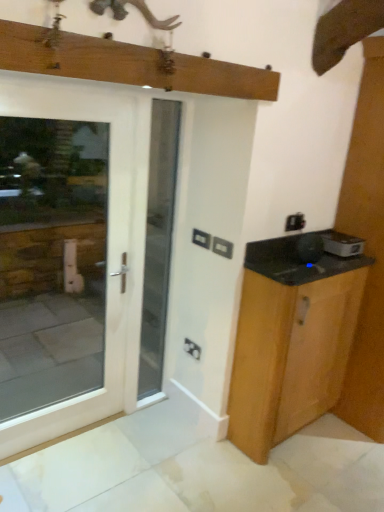
Question: From the image's perspective, is matte black electric outlet at center, which appears as the third electric outlet when viewed from the top, located beneath white glossy door at center?

Choices:
 (A) no
 (B) yes

Answer: (B)

Question: From a real-world perspective, is matte black electric outlet at center, which appears as the third electric outlet when viewed from the top, located beneath white glossy door at center?

Choices:
 (A) no
 (B) yes

Answer: (B)

Question: Is matte black electric outlet at center, the 1th electric outlet viewed from the back, wider than white glossy door at center?

Choices:
 (A) yes
 (B) no

Answer: (B)

Question: Is white glossy door at center inside matte black electric outlet at center, which appears as the third electric outlet when viewed from the top?

Choices:
 (A) yes
 (B) no

Answer: (B)

Question: Does matte black electric outlet at center, the 1th electric outlet viewed from the back, appear on the left side of white glossy door at center?

Choices:
 (A) yes
 (B) no

Answer: (B)

Question: From the image's perspective, is wooden cabinet at right positioned above or below matte black electric outlet at center, the 1th electric outlet viewed from the back?

Choices:
 (A) below
 (B) above

Answer: (B)

Question: Relative to matte black electric outlet at center, which appears as the third electric outlet when viewed from the top, is wooden cabinet at right in front or behind?

Choices:
 (A) front
 (B) behind

Answer: (A)

Question: Considering the positions of wooden cabinet at right and matte black electric outlet at center, which is the 1th electric outlet in bottom-to-top order, in the image, is wooden cabinet at right bigger or smaller than matte black electric outlet at center, which is the 1th electric outlet in bottom-to-top order,?

Choices:
 (A) big
 (B) small

Answer: (A)

Question: In terms of height, does wooden cabinet at right look taller or shorter compared to matte black electric outlet at center, the 1th electric outlet viewed from the back?

Choices:
 (A) tall
 (B) short

Answer: (A)

Question: Based on their sizes in the image, would you say white wood door at left is bigger or smaller than black plastic electric outlet at center, the 2th electric outlet positioned from the bottom?

Choices:
 (A) big
 (B) small

Answer: (A)

Question: From a real-world perspective, is white wood door at left physically located above or below black plastic electric outlet at center, positioned as the first electric outlet in front-to-back order?

Choices:
 (A) above
 (B) below

Answer: (B)

Question: Is point (39, 159) closer or farther from the camera than point (226, 249)?

Choices:
 (A) closer
 (B) farther

Answer: (B)

Question: Looking at their shapes, would you say white wood door at left is wider or thinner than black plastic electric outlet at center, acting as the third electric outlet starting from the back?

Choices:
 (A) thin
 (B) wide

Answer: (B)

Question: In terms of width, does white wood door at left look wider or thinner when compared to wooden cabinet at right?

Choices:
 (A) wide
 (B) thin

Answer: (B)

Question: In the image, is white wood door at left on the left side or the right side of wooden cabinet at right?

Choices:
 (A) left
 (B) right

Answer: (A)